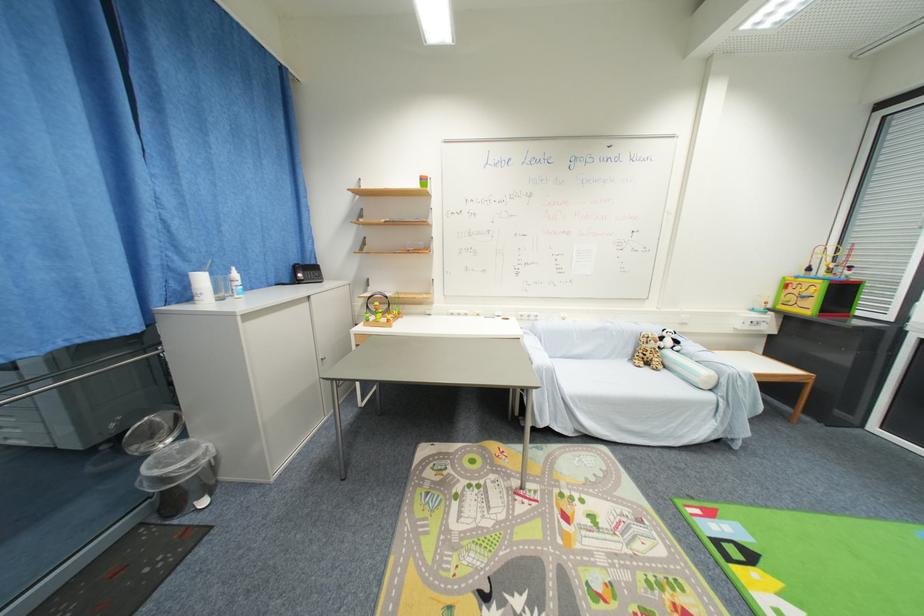
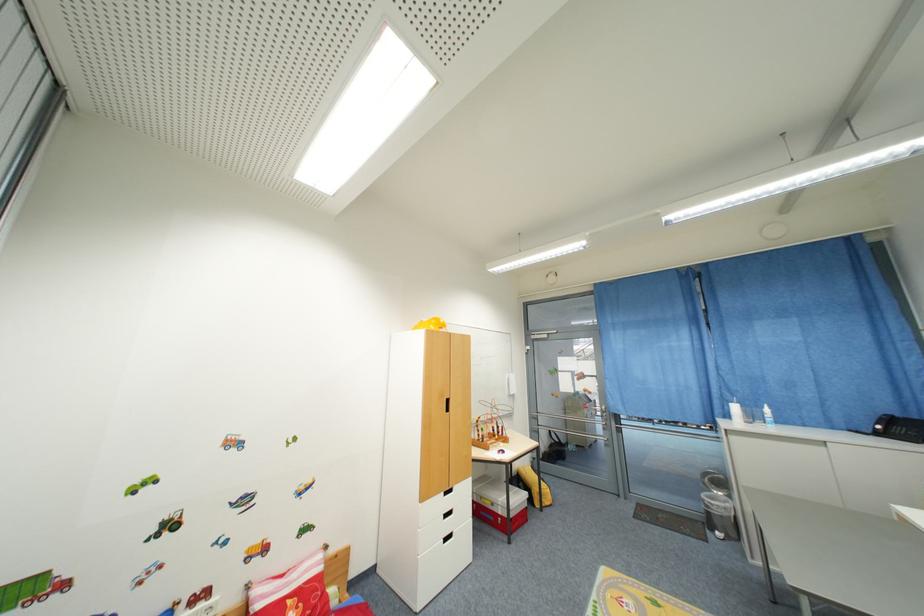
Find the pixel in the second image that matches the point at 207,282 in the first image.

(740, 410)